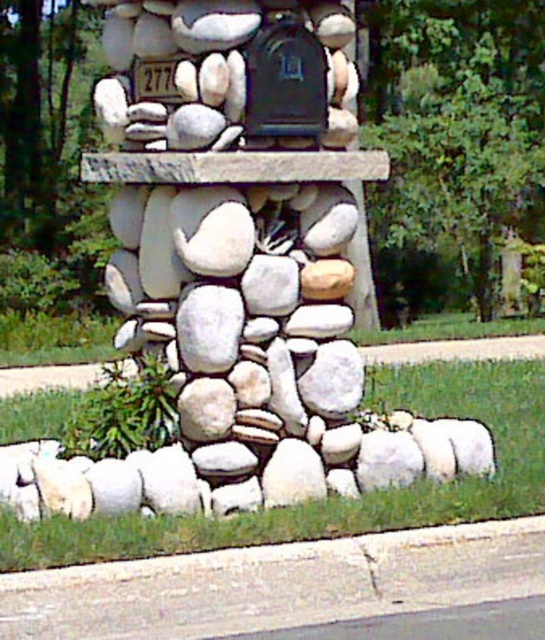
You are a delivery person trying to place a package in the mailbox. The white stone sculpture at center and the gray concrete curb at lower left are in your way. Which object is closer to the mailbox?

The white stone sculpture at center is closer to the mailbox than the gray concrete curb at lower left because it is positioned to the left of the curb, which would place it nearer to the mailbox structure.

You are designing a pathway that needs to pass between the gray concrete curb at lower left and the black matte mailbox at center. Which object has a wider base to accommodate more space for the pathway?

The gray concrete curb at lower left has a wider base than the black matte mailbox at center, so it can accommodate more space for the pathway.

You are a postal worker delivering a package to the black matte mailbox at center. You need to place a small package on the white stone sculpture at center first before proceeding. Given that your arm reaches 40 centimeters, can you reach the package from the mailbox to the sculpture?

The distance between the white stone sculpture at center and the black matte mailbox at center is 41.84 centimeters. Since your arm only reaches 40 centimeters, you cannot reach the package from the mailbox to the sculpture.